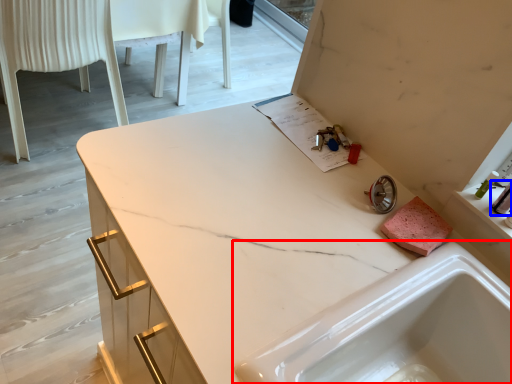
Question: Which point is further to the camera, sink (highlighted by a red box) or toiletry (highlighted by a blue box)?

Choices:
 (A) sink
 (B) toiletry

Answer: (B)